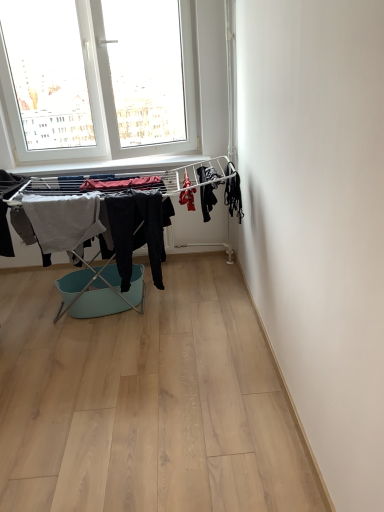
Question: Is dark gray fabric pants at center, which is the second clothing in left-to-right order, positioned with its back to light gray cotton towel at left, which is counted as the 5th clothing, starting from the right?

Choices:
 (A) no
 (B) yes

Answer: (A)

Question: Is the position of dark gray fabric pants at center, the 4th clothing in the right-to-left sequence, more distant than that of light gray cotton towel at left, which is counted as the 5th clothing, starting from the right?

Choices:
 (A) no
 (B) yes

Answer: (A)

Question: Is dark gray fabric pants at center, which is the second clothing in left-to-right order, thinner than light gray cotton towel at left, the 1th clothing when ordered from left to right?

Choices:
 (A) no
 (B) yes

Answer: (A)

Question: Does dark gray fabric pants at center, the 4th clothing in the right-to-left sequence, turn towards light gray cotton towel at left, the 1th clothing when ordered from left to right?

Choices:
 (A) no
 (B) yes

Answer: (A)

Question: From the image's perspective, is dark gray fabric pants at center, which is the second clothing in left-to-right order, on light gray cotton towel at left, the 1th clothing when ordered from left to right?

Choices:
 (A) no
 (B) yes

Answer: (A)

Question: Can you confirm if dark gray fabric pants at center, the 4th clothing in the right-to-left sequence, is taller than light gray cotton towel at left, the 1th clothing when ordered from left to right?

Choices:
 (A) no
 (B) yes

Answer: (B)

Question: Would you say red fabric at center, the 3th clothing positioned from the left, contains mint plastic laundry basket at center?

Choices:
 (A) no
 (B) yes

Answer: (A)

Question: Is red fabric at center, which is the third clothing from right to left, facing away from mint plastic laundry basket at center?

Choices:
 (A) no
 (B) yes

Answer: (A)

Question: Can you confirm if red fabric at center, which is the third clothing from right to left, is taller than mint plastic laundry basket at center?

Choices:
 (A) no
 (B) yes

Answer: (A)

Question: From the image's perspective, would you say red fabric at center, the 3th clothing positioned from the left, is shown under mint plastic laundry basket at center?

Choices:
 (A) yes
 (B) no

Answer: (B)

Question: Does red fabric at center, which is the third clothing from right to left, appear on the right side of mint plastic laundry basket at center?

Choices:
 (A) no
 (B) yes

Answer: (B)

Question: From the image's perspective, does red fabric at center, the 3th clothing positioned from the left, appear higher than mint plastic laundry basket at center?

Choices:
 (A) no
 (B) yes

Answer: (B)

Question: Does light gray cotton towel at left, the 1th clothing when ordered from left to right, have a lesser width compared to black matte fabric at right, which ranks as the fifth clothing in left-to-right order?

Choices:
 (A) yes
 (B) no

Answer: (A)